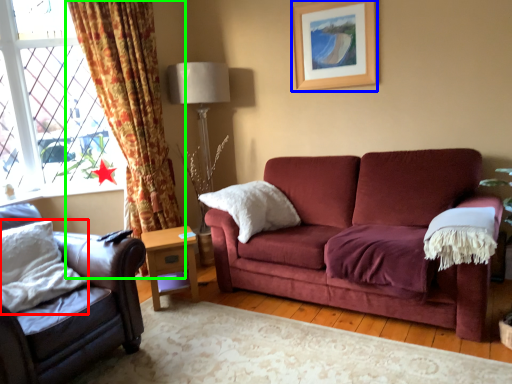
Question: Which object is positioned closest to pillow (highlighted by a red box)? Select from picture frame (highlighted by a blue box) and curtain (highlighted by a green box).

Choices:
 (A) picture frame
 (B) curtain

Answer: (B)